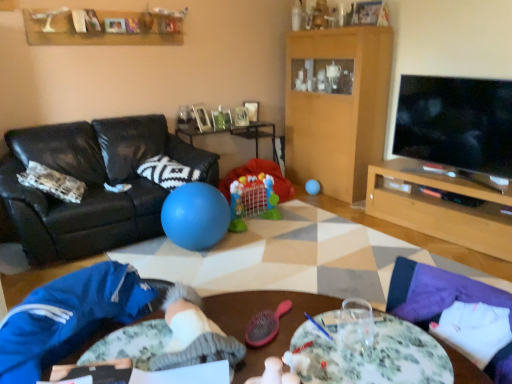
At what (x,y) coordinates should I click in order to perform the action: click on vacant point above floral-patterned glass at center (from a real-world perspective). Please return your answer as a coordinate pair (x, y). Looking at the image, I should click on (366, 348).